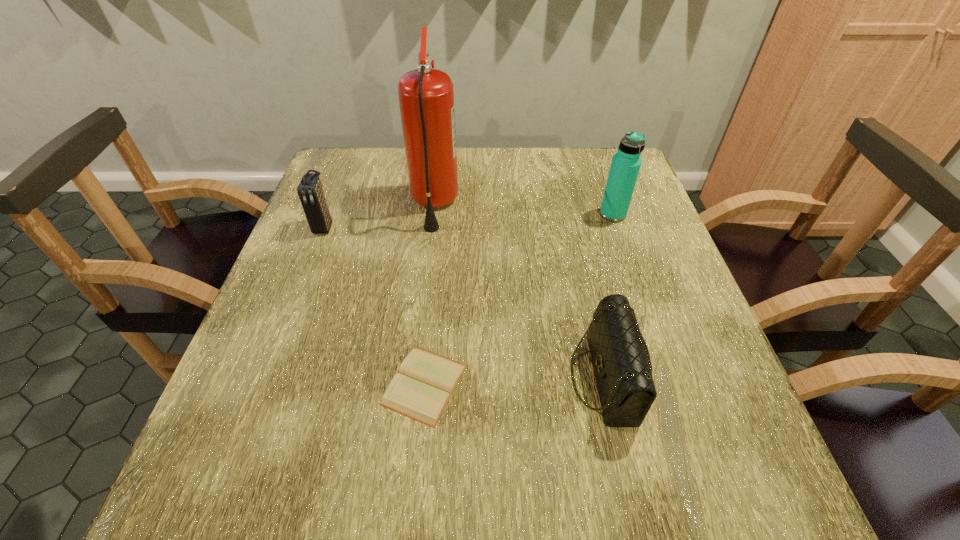
The image size is (960, 540). I want to click on vacant area situated 0.080m with the zip open on the third shortest object, so click(310, 261).

You are a GUI agent. You are given a task and a screenshot of the screen. Output one action in this format:
    pyautogui.click(x=<x>, y=<y>)
    Task: Click on the free space located 0.060m on the front flap of the second shortest object
    The image size is (960, 540).
    Given the screenshot: What is the action you would take?
    pyautogui.click(x=539, y=378)

Identify the location of vacant space located on the front flap of the second shortest object. The height and width of the screenshot is (540, 960). (432, 378).

At what (x,y) coordinates should I click in order to perform the action: click on free space located 0.240m on the front flap of the second shortest object. Please return your answer as a coordinate pair (x, y). Image resolution: width=960 pixels, height=540 pixels. Looking at the image, I should click on (438, 378).

Find the location of a particular element. The width and height of the screenshot is (960, 540). vacant space located 0.060m on the left of the shortest object is located at coordinates (349, 384).

This screenshot has height=540, width=960. What are the coordinates of `object located in the far edge section of the desktop` in the screenshot? It's located at (426, 97).

Locate an element on the screen. The width and height of the screenshot is (960, 540). object at the left edge is located at coordinates (310, 191).

Where is `water bottle at the right edge`? water bottle at the right edge is located at coordinates (626, 163).

You are a GUI agent. You are given a task and a screenshot of the screen. Output one action in this format:
    pyautogui.click(x=<x>, y=<y>)
    Task: Click on the clutch bag present at the right edge
    The height and width of the screenshot is (540, 960).
    Given the screenshot: What is the action you would take?
    pyautogui.click(x=620, y=357)

This screenshot has height=540, width=960. In the image, there is a desktop. Identify the location of vacant region at the far edge. [x=497, y=157].